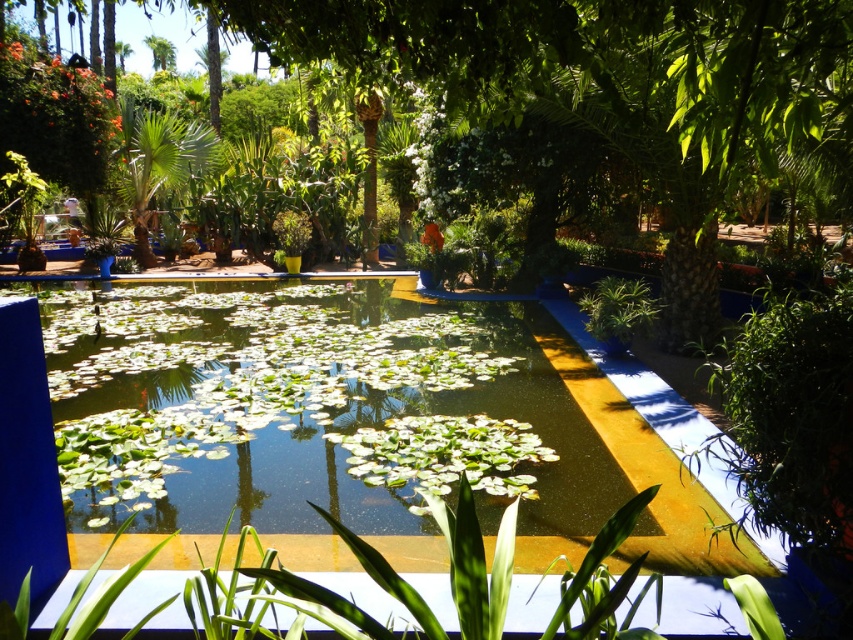
Does point (553, 358) come behind point (691, 150)?

Yes, it is behind point (691, 150).

Who is shorter, green leafy pool at center or green leafy tree at center?

green leafy tree at center

Find the location of a particular element. green leafy pool at center is located at coordinates (358, 424).